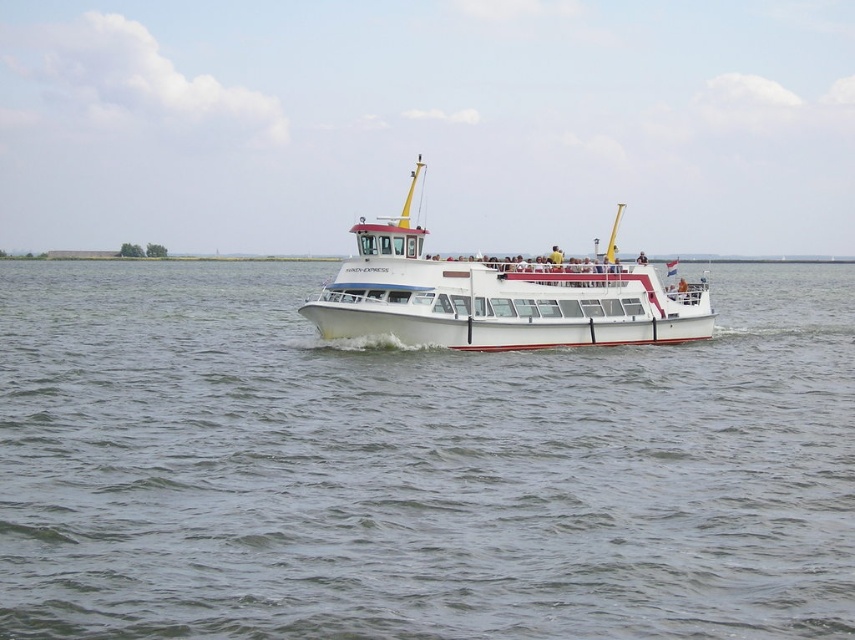
You are a photographer on the ferry and want to capture the entire white glossy boat at center in your photo. However, the white water at center is also visible in the frame. Based on their sizes in the image, which object takes up more space in the photo?

The white glossy boat at center takes up more space in the photo because the white water at center occupies less space than the white glossy boat at center.

You are a passenger on the HARDE EXPRESS ferry and you want to take a photo of the white water at center. Where should you stand on the ferry to get the best view of it?

The white water at center is located at coordinate point (416, 467). To capture it in your photo, position yourself near the center of the ferry facing towards the area where the coordinates indicate the white water is situated.